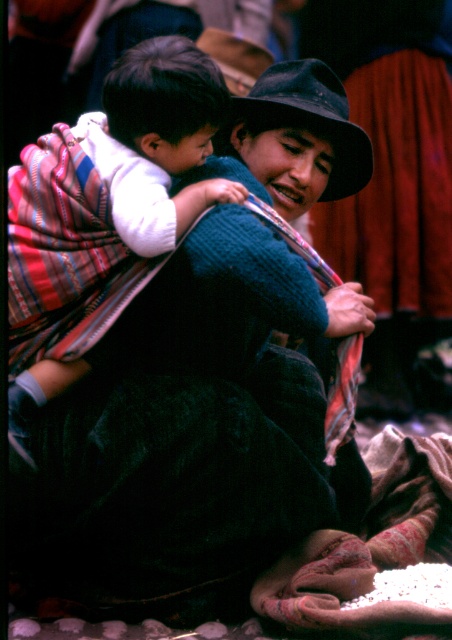
Is knitted dark blue sweater at center bigger than black felt hat at upper center?

Yes.

Does knitted dark blue sweater at center lie behind black felt hat at upper center?

That is False.

What do you see at coordinates (169, 412) in the screenshot? I see `knitted dark blue sweater at center` at bounding box center [169, 412].

The image size is (452, 640). I want to click on knitted dark blue sweater at center, so click(169, 412).

Does knitted dark blue sweater at center have a lesser height compared to white soft cloth at center?

No.

The width and height of the screenshot is (452, 640). Describe the element at coordinates (169, 412) in the screenshot. I see `knitted dark blue sweater at center` at that location.

At what (x,y) coordinates should I click in order to perform the action: click on knitted dark blue sweater at center. Please return your answer as a coordinate pair (x, y). Image resolution: width=452 pixels, height=640 pixels. Looking at the image, I should click on (169, 412).

Is point (121, 104) positioned in front of point (232, 109)?

Yes, it is in front of point (232, 109).

Which is more to the left, white soft cloth at center or black felt hat at upper center?

From the viewer's perspective, white soft cloth at center appears more on the left side.

Does point (159, 268) lie behind point (253, 128)?

No, it is not.

Identify the location of white soft cloth at center. (156, 145).